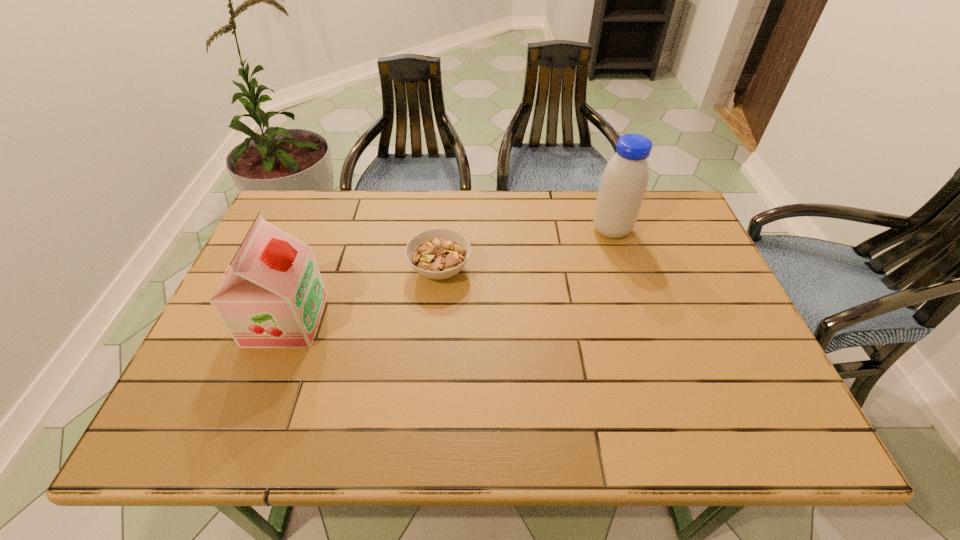
Identify the location of vacant area that lies between the second object from left to right and the nearer soya milk. The height and width of the screenshot is (540, 960). (363, 295).

What are the coordinates of `free space between the nearest object and the shortest object` in the screenshot? It's located at (363, 295).

Locate an element on the screen. vacant region between the second farthest object and the left soya milk is located at coordinates click(363, 295).

At what (x,y) coordinates should I click in order to perform the action: click on the second closest object relative to the left soya milk. Please return your answer as a coordinate pair (x, y). The image size is (960, 540). Looking at the image, I should click on tap(624, 181).

Identify which object is located as the second nearest to the farther soya milk. Please provide its 2D coordinates. Your answer should be formatted as a tuple, i.e. [(x, y)], where the tuple contains the x and y coordinates of a point satisfying the conditions above.

[(272, 295)]

This screenshot has height=540, width=960. What are the coordinates of `free space that satisfies the following two spatial constraints: 1. on the front side of the shortest object; 2. with the cap open on the nearest object` in the screenshot? It's located at (436, 320).

Locate an element on the screen. This screenshot has width=960, height=540. vacant space that satisfies the following two spatial constraints: 1. on the back side of the farther soya milk; 2. on the left side of the shortest object is located at coordinates (444, 230).